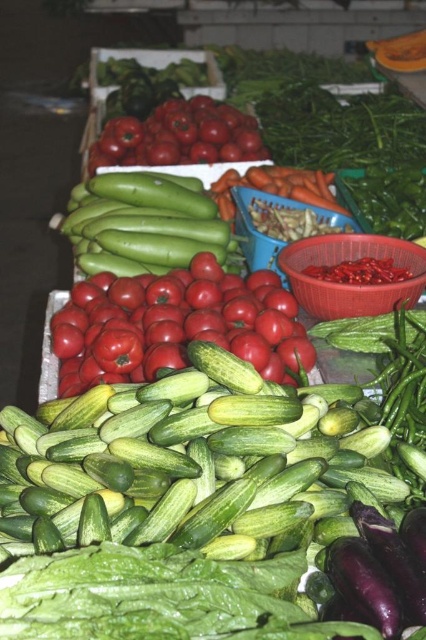
Question: Can you confirm if shiny red tomatoes at center is thinner than shiny red tomatoes at upper center?

Choices:
 (A) yes
 (B) no

Answer: (A)

Question: In this image, where is green smooth cucumber at center located relative to orange smooth carrot at center?

Choices:
 (A) right
 (B) left

Answer: (B)

Question: Which object is positioned farthest from the orange smooth carrot at center?

Choices:
 (A) shiny red tomatoes at upper center
 (B) purple matte eggplant at lower right
 (C) shiny red tomatoes at center
 (D) green smooth cucumber at center

Answer: (B)

Question: Which point is farther to the camera?

Choices:
 (A) (230, 179)
 (B) (184, 433)

Answer: (A)

Question: Which point is farther to the camera?

Choices:
 (A) orange smooth carrot at center
 (B) shiny red tomatoes at upper center
 (C) green smooth cucumber at center
 (D) shiny red tomatoes at center

Answer: (B)

Question: Does shiny red tomatoes at center appear over orange smooth carrot at center?

Choices:
 (A) no
 (B) yes

Answer: (A)